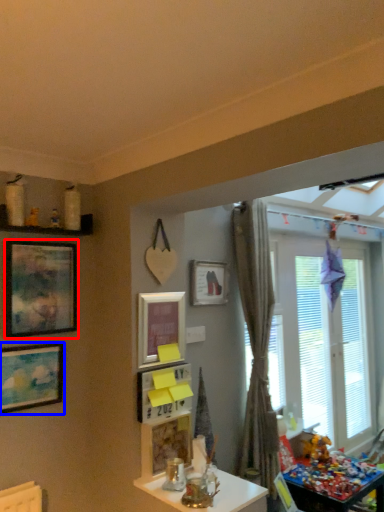
Question: Which of the following is the farthest to the observer, picture frame (highlighted by a red box) or picture frame (highlighted by a blue box)?

Choices:
 (A) picture frame
 (B) picture frame

Answer: (A)